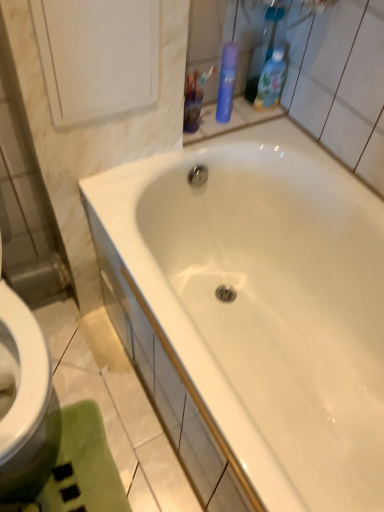
Question: Is blue glossy bottle at upper right, the 1th cleaning product when ordered from right to left, wider or thinner than green plush bath mat at lower left?

Choices:
 (A) thin
 (B) wide

Answer: (A)

Question: From a real-world perspective, is blue glossy bottle at upper right, marked as the 2th cleaning product in a left-to-right arrangement, positioned above or below green plush bath mat at lower left?

Choices:
 (A) above
 (B) below

Answer: (A)

Question: Estimate the real-world distances between objects in this image. Which object is farther from the blue matte spray can at upper right, marked as the first cleaning product in a left-to-right arrangement?

Choices:
 (A) white glossy bathtub at center
 (B) blue glossy bottle at upper right, marked as the 2th cleaning product in a left-to-right arrangement
 (C) white glossy medicine cabinet at upper left
 (D) green plush bath mat at lower left
 (E) translucent plastic cup at upper center

Answer: (D)

Question: Based on their relative distances, which object is farther from the blue glossy bottle at upper right, marked as the 2th cleaning product in a left-to-right arrangement?

Choices:
 (A) translucent plastic cup at upper center
 (B) white glossy bathtub at center
 (C) white glossy medicine cabinet at upper left
 (D) blue matte spray can at upper right, marked as the first cleaning product in a left-to-right arrangement
 (E) green plush bath mat at lower left

Answer: (E)